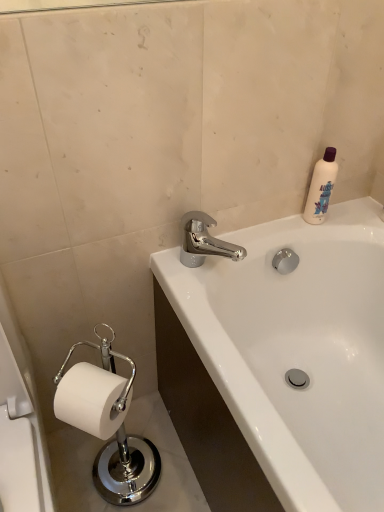
Question: Based on their positions, is white glossy bathtub at upper right located to the left or right of chrome metallic faucet at upper center?

Choices:
 (A) left
 (B) right

Answer: (B)

Question: Which is correct: white glossy bathtub at upper right is inside chrome metallic faucet at upper center, or outside of it?

Choices:
 (A) outside
 (B) inside

Answer: (A)

Question: Which object is the farthest from the chrome metallic faucet at upper center?

Choices:
 (A) white glossy bathtub at upper right
 (B) white paper at lower left
 (C) white plastic bottle at upper right

Answer: (B)

Question: Estimate the real-world distances between objects in this image. Which object is farther from the chrome metallic faucet at upper center?

Choices:
 (A) white glossy bathtub at upper right
 (B) white plastic bottle at upper right
 (C) white paper at lower left

Answer: (C)